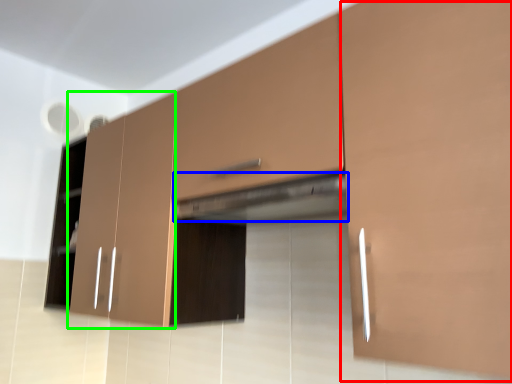
Question: Considering the real-world distances, which object is closest to cabinetry (highlighted by a red box)? exhaust hood (highlighted by a blue box) or cabinetry (highlighted by a green box).

Choices:
 (A) exhaust hood
 (B) cabinetry

Answer: (A)